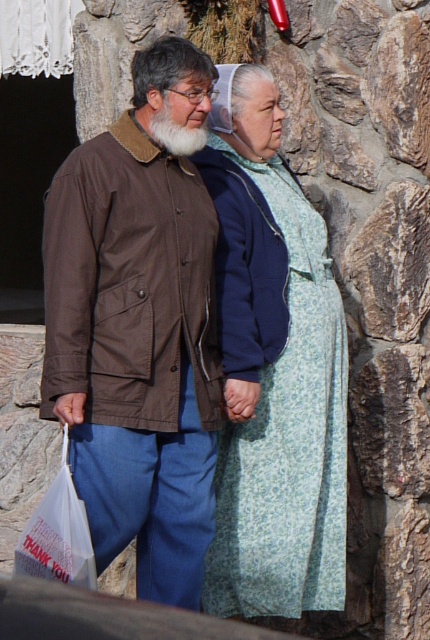
You are a photographer trying to capture a photo of the light green floral dress at center and the white plastic bag at lower left. Since the dress is covering the bag, how can you adjust your camera angle to ensure both are visible in the frame?

The light green floral dress at center is positioned over the white plastic bag at lower left. To ensure both are visible, you can lower your camera angle to capture the bag below the dress or move slightly to the side to reveal the bag behind the dress.

You are standing in front of the stone wall and want to hand the white plastic bag at lower left to the person wearing the light green floral dress at center. Which object should you move closer to first?

You should move closer to the light green floral dress at center first because it is closer to you than the white plastic bag at lower left, which is further away.

In the scene shown: You are standing in front of the stone wall and want to place a small decoration. You have two points marked on the wall where you can place it. The first point is at coordinates point (106, 387) and the second is at point (251, 394). Which point is closer to you?

Point (106, 387) is closer to the camera than point (251, 394), so the first point is closer to you.